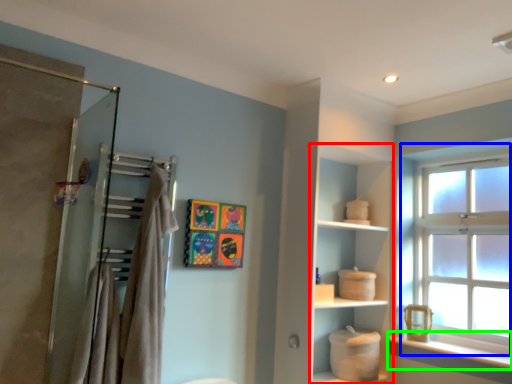
Question: Based on their relative distances, which object is farther from cabinet (highlighted by a red box)? Choose from window (highlighted by a blue box) and window sill (highlighted by a green box).

Choices:
 (A) window
 (B) window sill

Answer: (B)